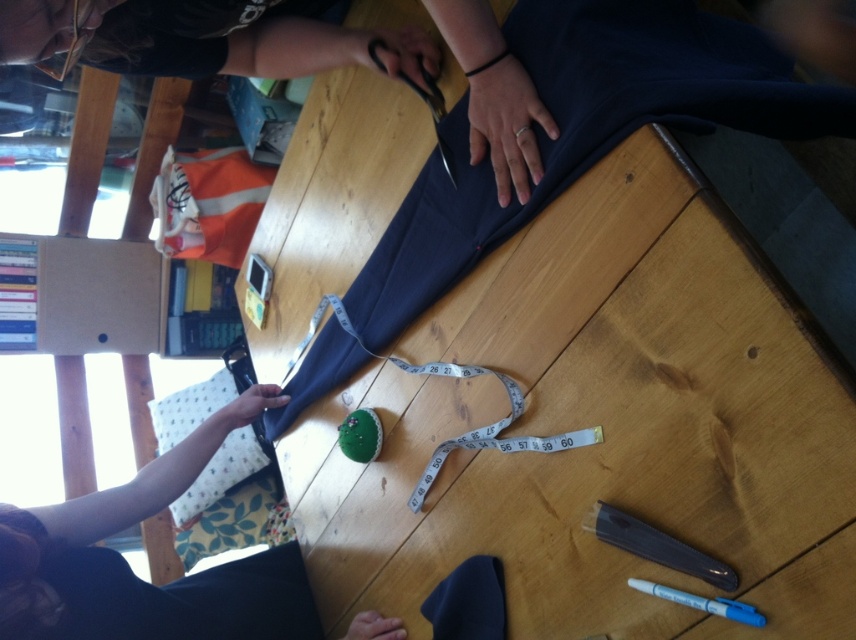
Question: Which point is farther from the camera taking this photo?

Choices:
 (A) (749, 612)
 (B) (46, 10)
 (C) (262, 580)
 (D) (563, 305)

Answer: (C)

Question: Which of the following is the closest to the observer?

Choices:
 (A) (x=111, y=3)
 (B) (x=675, y=538)
 (C) (x=176, y=474)

Answer: (B)

Question: Is wooden table at center to the right of translucent plastic pen at lower right from the viewer's perspective?

Choices:
 (A) no
 (B) yes

Answer: (A)

Question: Which object appears closest to the camera in this image?

Choices:
 (A) matte black fabric at upper center
 (B) translucent plastic pen at lower right
 (C) blue plastic pen at lower right

Answer: (C)

Question: From the image, what is the correct spatial relationship of smooth navy fabric at upper left in relation to translucent plastic pen at lower right?

Choices:
 (A) right
 (B) left

Answer: (B)

Question: Does wooden table at center have a larger size compared to metallic sheen scissors at upper center?

Choices:
 (A) no
 (B) yes

Answer: (B)